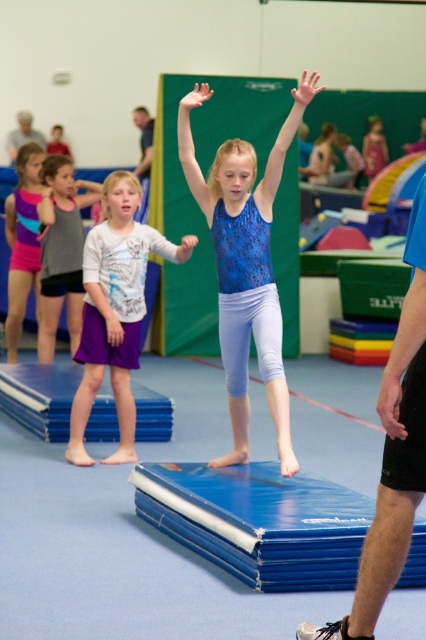
In the scene shown: You are a physical therapist assessing the clothing of two children in the gym. The blue fabric shorts at lower right and the gray fabric tank top at left are both made of the same material. Which clothing item would you expect to provide less resistance during movement?

The blue fabric shorts at lower right is thinner than the gray fabric tank top at left, so it would provide less resistance during movement.

Based on the coordinates provided, which object corresponds to the point at (x=239, y=164) in the gymnasium scene?

The point at (x=239, y=164) corresponds to the blue fabric gymnast at center.